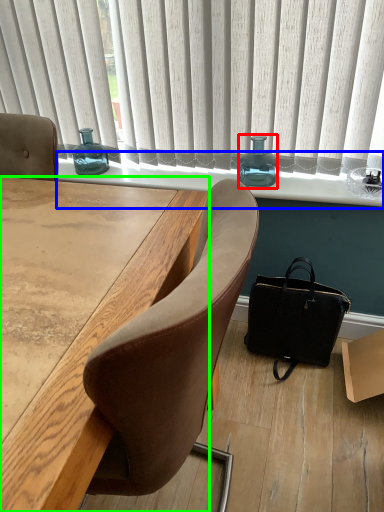
Question: Which object is the closest to the bottle (highlighted by a red box)? Choose among these: window sill (highlighted by a blue box) or desk (highlighted by a green box).

Choices:
 (A) window sill
 (B) desk

Answer: (A)